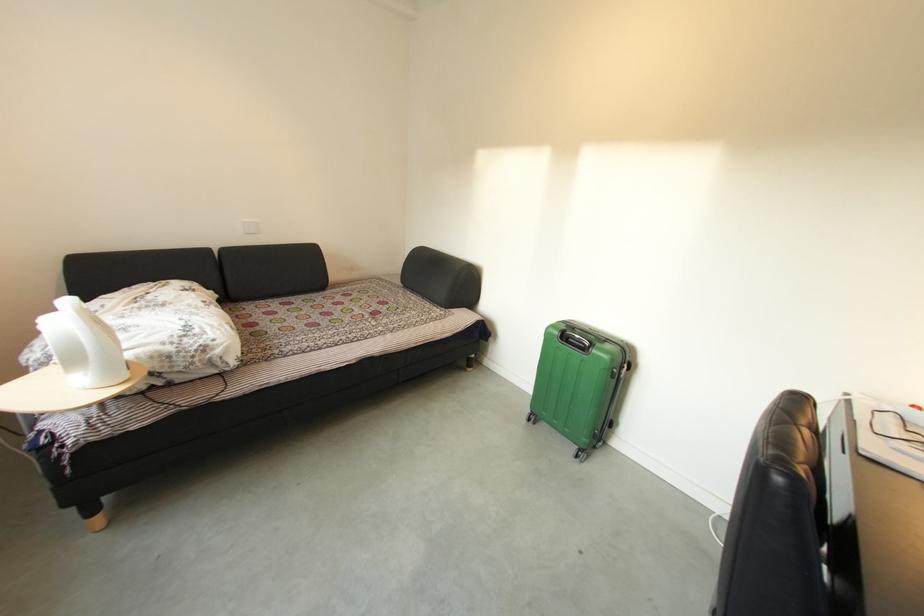
Locate an element on the screen. sofa sitting surface is located at coordinates (298, 334).